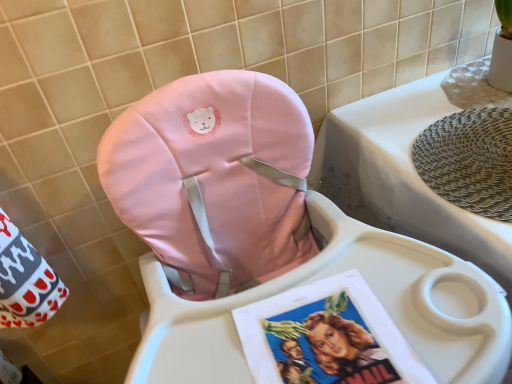
Question: Could you tell me if white plastic changing table at upper right is facing matte pink cushion at center?

Choices:
 (A) yes
 (B) no

Answer: (B)

Question: Is white plastic changing table at upper right smaller than matte pink cushion at center?

Choices:
 (A) yes
 (B) no

Answer: (A)

Question: Is white plastic changing table at upper right positioned with its back to matte pink cushion at center?

Choices:
 (A) no
 (B) yes

Answer: (A)

Question: Can you confirm if white plastic changing table at upper right is taller than matte pink cushion at center?

Choices:
 (A) yes
 (B) no

Answer: (B)

Question: Is matte pink cushion at center completely or partially inside white plastic changing table at upper right?

Choices:
 (A) yes
 (B) no

Answer: (B)

Question: Is there a large distance between white plastic changing table at upper right and matte pink cushion at center?

Choices:
 (A) no
 (B) yes

Answer: (A)

Question: Is matte pink cushion at center taller than white plastic changing table at upper right?

Choices:
 (A) yes
 (B) no

Answer: (A)

Question: Is matte pink cushion at center not inside white plastic changing table at upper right?

Choices:
 (A) yes
 (B) no

Answer: (A)

Question: Is matte pink cushion at center positioned before white plastic changing table at upper right?

Choices:
 (A) no
 (B) yes

Answer: (B)

Question: Does matte pink cushion at center contain white plastic changing table at upper right?

Choices:
 (A) no
 (B) yes

Answer: (A)

Question: Does matte pink cushion at center have a smaller size compared to white plastic changing table at upper right?

Choices:
 (A) no
 (B) yes

Answer: (A)

Question: Can you confirm if matte pink cushion at center is shorter than white plastic changing table at upper right?

Choices:
 (A) no
 (B) yes

Answer: (A)

Question: From a real-world perspective, is white plastic changing table at upper right above or below matte pink cushion at center?

Choices:
 (A) above
 (B) below

Answer: (B)